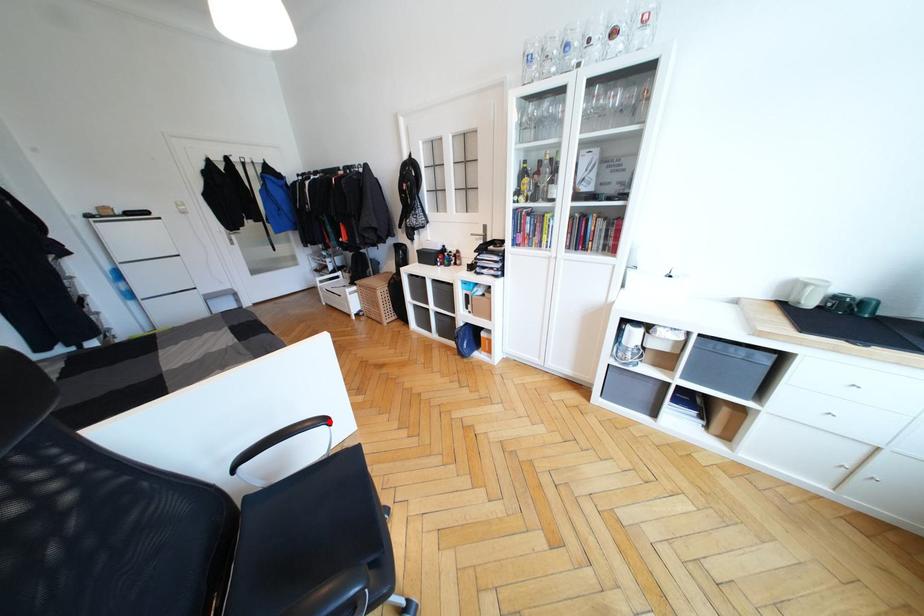
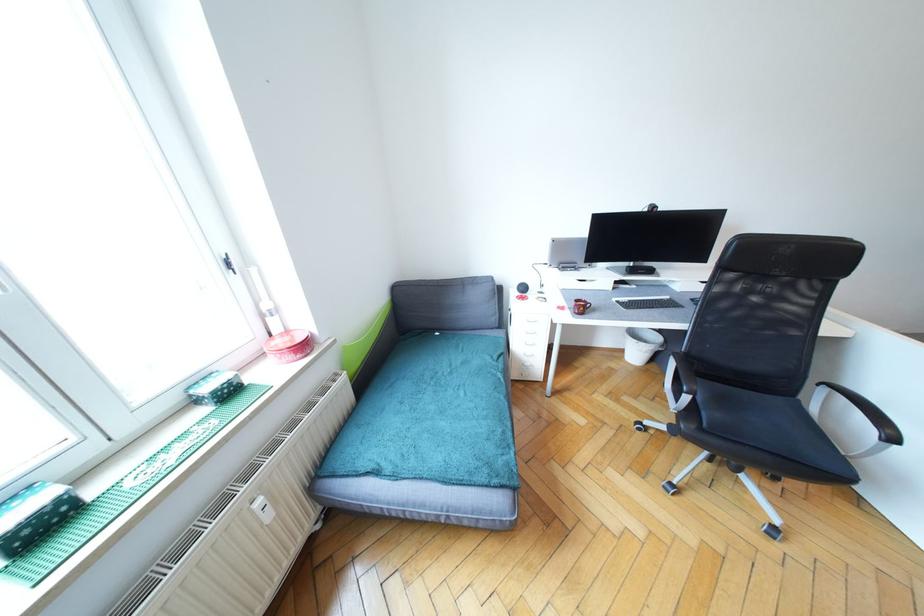
In the second image, find the point that corresponds to the highlighted location in the first image.

(896, 440)